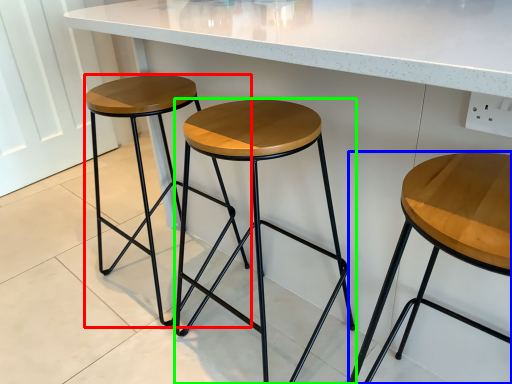
Question: Which is nearer to the stool (highlighted by a red box)? stool (highlighted by a blue box) or stool (highlighted by a green box).

Choices:
 (A) stool
 (B) stool

Answer: (B)